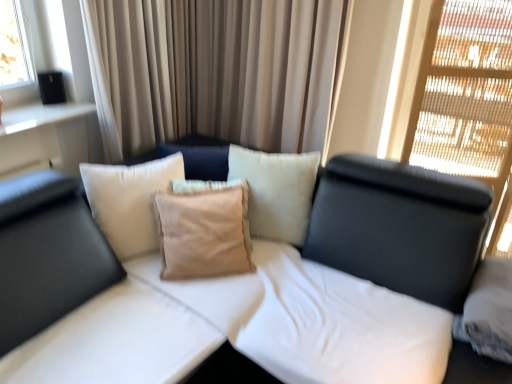
Question: Is suede beige pillow at center touching translucent wood screen at upper right?

Choices:
 (A) yes
 (B) no

Answer: (B)

Question: Is suede beige pillow at center surrounding translucent wood screen at upper right?

Choices:
 (A) yes
 (B) no

Answer: (B)

Question: From a real-world perspective, is suede beige pillow at center located higher than translucent wood screen at upper right?

Choices:
 (A) no
 (B) yes

Answer: (A)

Question: Does suede beige pillow at center have a lesser width compared to translucent wood screen at upper right?

Choices:
 (A) no
 (B) yes

Answer: (B)

Question: From the image's perspective, does suede beige pillow at center appear lower than translucent wood screen at upper right?

Choices:
 (A) no
 (B) yes

Answer: (B)

Question: In the image, is satin beige curtain at center on the left side or the right side of suede beige pillow at center?

Choices:
 (A) left
 (B) right

Answer: (B)

Question: Would you say satin beige curtain at center is inside or outside suede beige pillow at center?

Choices:
 (A) inside
 (B) outside

Answer: (B)

Question: Is satin beige curtain at center taller or shorter than suede beige pillow at center?

Choices:
 (A) tall
 (B) short

Answer: (A)

Question: Is point (98, 74) closer or farther from the camera than point (220, 215)?

Choices:
 (A) closer
 (B) farther

Answer: (B)

Question: From the image's perspective, is translucent wood screen at upper right above or below suede beige pillow at center?

Choices:
 (A) above
 (B) below

Answer: (A)

Question: Is translucent wood screen at upper right in front of or behind suede beige pillow at center in the image?

Choices:
 (A) behind
 (B) front

Answer: (B)

Question: Is translucent wood screen at upper right situated inside suede beige pillow at center or outside?

Choices:
 (A) inside
 (B) outside

Answer: (B)

Question: From a real-world perspective, is translucent wood screen at upper right above or below suede beige pillow at center?

Choices:
 (A) below
 (B) above

Answer: (B)

Question: Considering the relative positions of white fabric studio couch at center and suede beige pillow at center in the image provided, is white fabric studio couch at center to the left or to the right of suede beige pillow at center?

Choices:
 (A) left
 (B) right

Answer: (B)

Question: Is point (262, 273) positioned closer to the camera than point (186, 248)?

Choices:
 (A) closer
 (B) farther

Answer: (B)